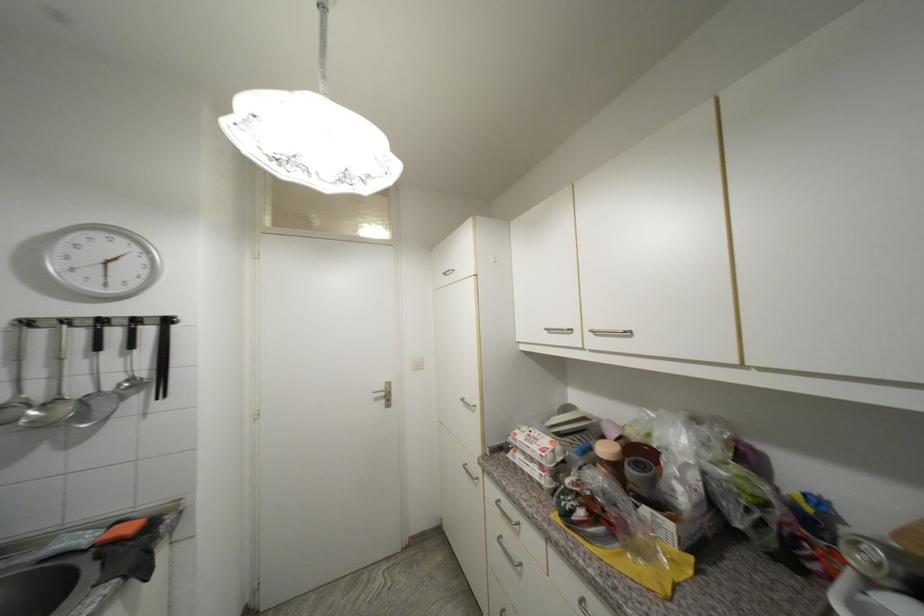
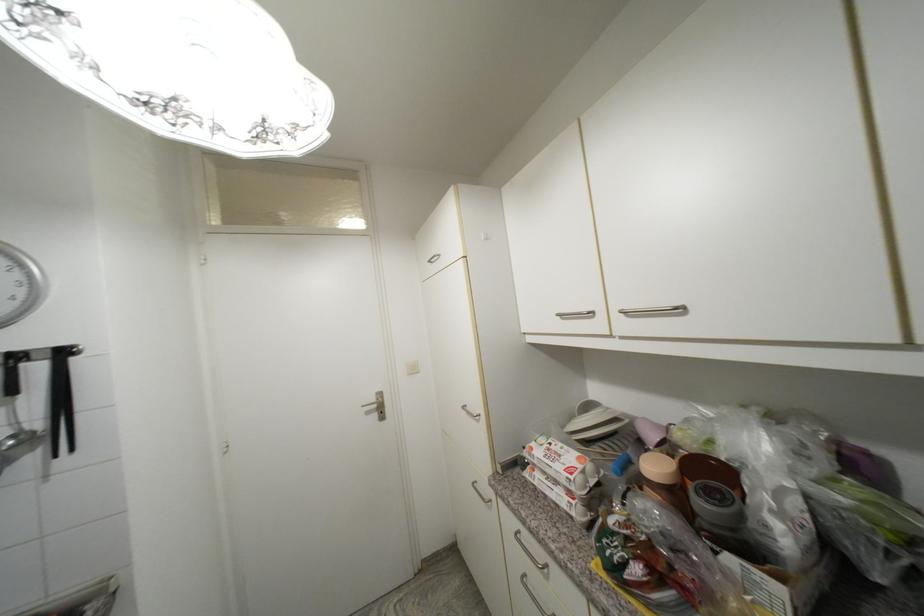
Where in the second image is the point corresponding to point (373, 177) from the first image?

(301, 128)